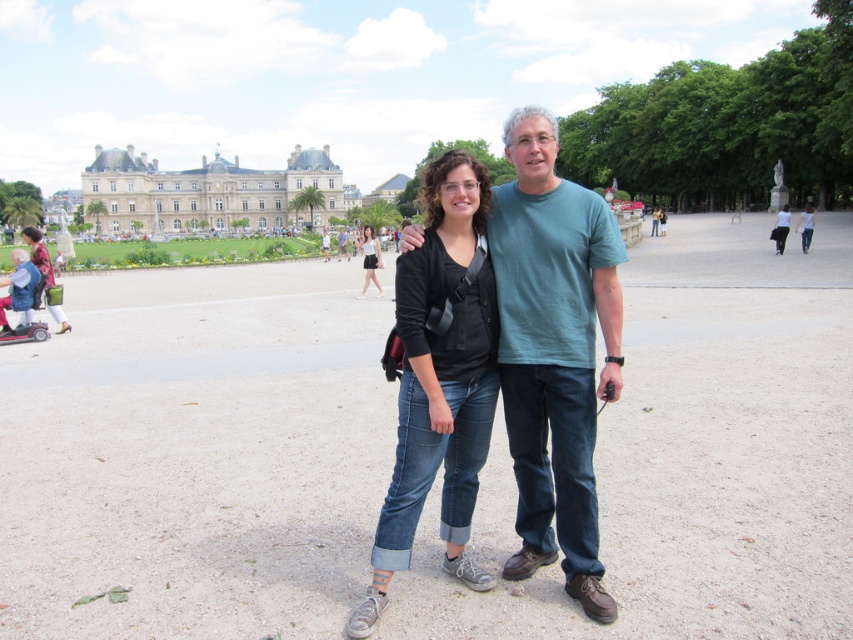
Can you confirm if denim jeans at center is positioned to the left of matte black top at center?

In fact, denim jeans at center is to the right of matte black top at center.

Who is positioned more to the left, denim jeans at center or matte black top at center?

matte black top at center

In order to click on denim jeans at center in this screenshot , I will do `click(439, 378)`.

Image resolution: width=853 pixels, height=640 pixels. I want to click on denim jeans at center, so click(439, 378).

Where is `teal cotton t-shirt at center`? The width and height of the screenshot is (853, 640). teal cotton t-shirt at center is located at coordinates (554, 352).

Does point (614, 376) lie behind point (440, 156)?

No, it is in front of (440, 156).

Where is `teal cotton t-shirt at center`? teal cotton t-shirt at center is located at coordinates (554, 352).

Is teal cotton t-shirt at center thinner than matte black top at center?

No, teal cotton t-shirt at center is not thinner than matte black top at center.

Who is more distant from viewer, (581,252) or (368,236)?

Positioned behind is point (368,236).

What do you see at coordinates (554, 352) in the screenshot? I see `teal cotton t-shirt at center` at bounding box center [554, 352].

Identify the location of teal cotton t-shirt at center. This screenshot has width=853, height=640. (554, 352).